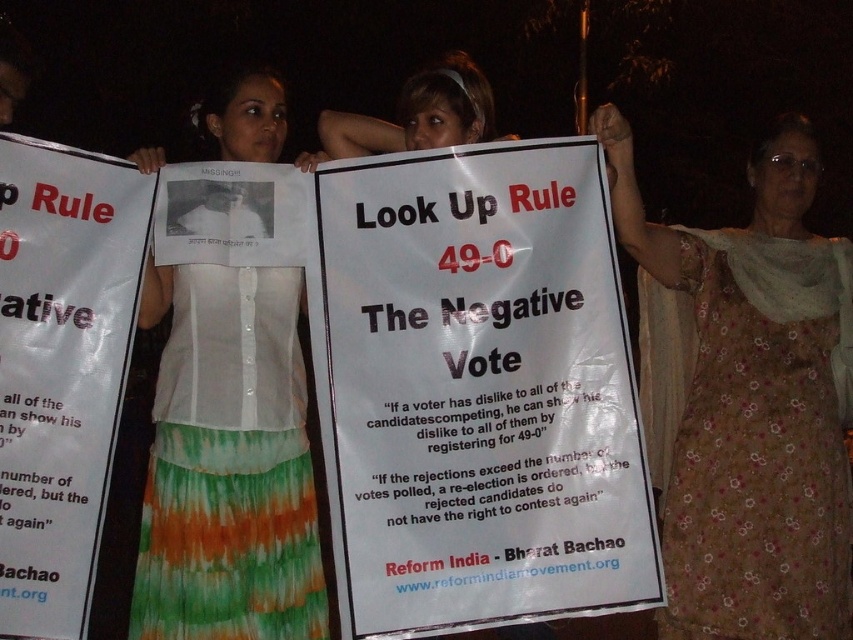
Question: Which point is closer to the camera?

Choices:
 (A) (114, 298)
 (B) (218, 106)

Answer: (A)

Question: Is the position of white paper poster at center less distant than that of white fabric shirt at center?

Choices:
 (A) no
 (B) yes

Answer: (B)

Question: Observing the image, what is the correct spatial positioning of white paper poster at center in reference to white paper poster at left?

Choices:
 (A) below
 (B) above

Answer: (A)

Question: Does floral printed dress at center come in front of white fabric shirt at center?

Choices:
 (A) yes
 (B) no

Answer: (B)

Question: Which of the following is the farthest from the observer?

Choices:
 (A) white fabric shirt at center
 (B) white paper poster at center

Answer: (A)

Question: Which object appears closest to the camera in this image?

Choices:
 (A) floral printed dress at center
 (B) white paper poster at center
 (C) white paper poster at left

Answer: (C)